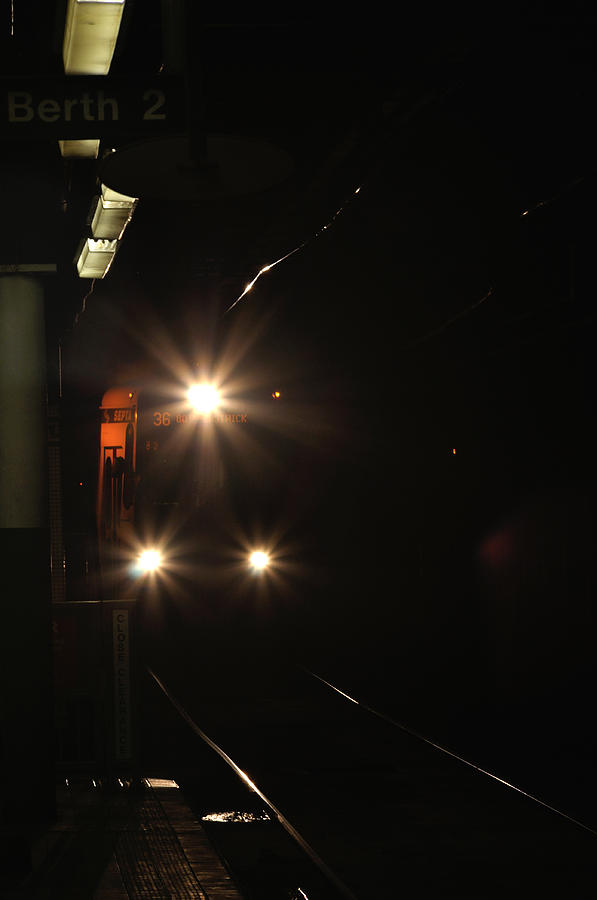
At what (x,y) coordinates should I click in order to perform the action: click on the top light. Please return your answer as a coordinate pair (x, y). Image resolution: width=597 pixels, height=900 pixels. Looking at the image, I should click on click(209, 400).